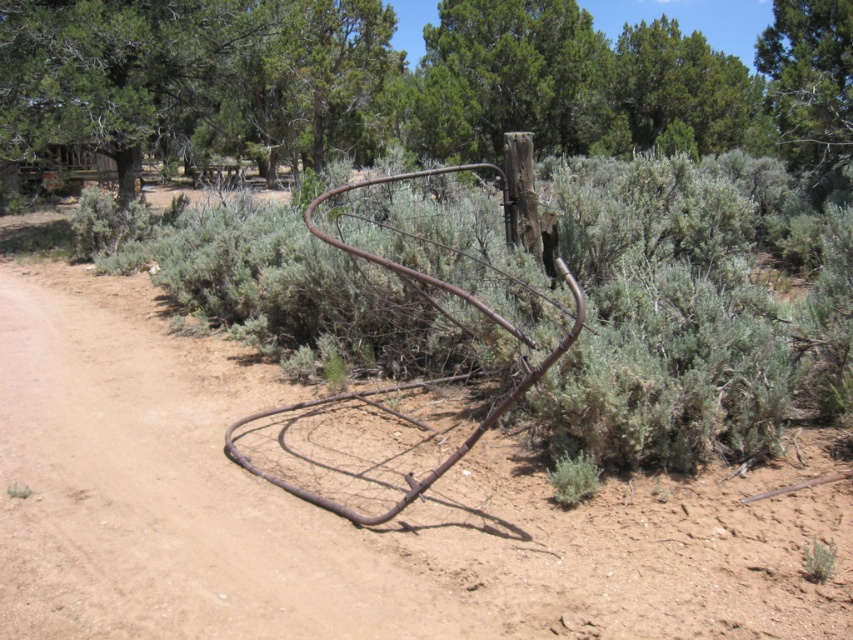
You are standing at the camera position looking at the scene. There are two points marked in the image, one at point coordinates point (74,604) and the other at point coordinates point (262,70). Which of these two points is nearer to you?

Point point (74,604) is closer to the camera than point point (262,70), so the point at point (74,604) is nearer to you.

You are a hiker lost in the desert and see the brown dirt track at center and the green leafy tree at upper center. Which direction should you head towards to find the tree?

The green leafy tree at upper center is to the left of the brown dirt track at center, so you should head towards the left to find the tree.